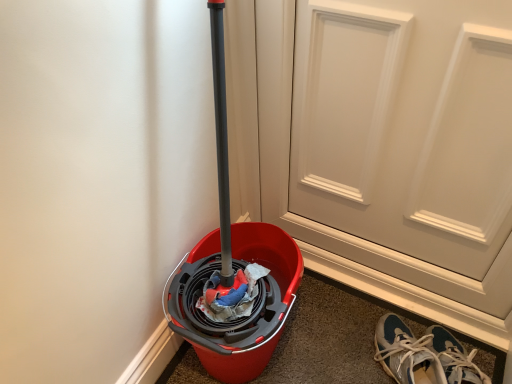
Question: Should I look upward or downward to see blue suede sneakers at lower right?

Choices:
 (A) up
 (B) down

Answer: (B)

Question: Considering the relative sizes of blue suede sneakers at lower right and white matte door at center in the image provided, is blue suede sneakers at lower right smaller than white matte door at center?

Choices:
 (A) no
 (B) yes

Answer: (B)

Question: Can you confirm if blue suede sneakers at lower right is positioned to the right of white matte door at center?

Choices:
 (A) no
 (B) yes

Answer: (B)

Question: From the image's perspective, is blue suede sneakers at lower right beneath white matte door at center?

Choices:
 (A) yes
 (B) no

Answer: (A)

Question: Does blue suede sneakers at lower right have a lesser height compared to white matte door at center?

Choices:
 (A) yes
 (B) no

Answer: (A)

Question: Considering the relative sizes of blue suede sneakers at lower right and white matte door at center in the image provided, is blue suede sneakers at lower right wider than white matte door at center?

Choices:
 (A) no
 (B) yes

Answer: (B)

Question: From a real-world perspective, does blue suede sneakers at lower right sit lower than white matte door at center?

Choices:
 (A) no
 (B) yes

Answer: (B)

Question: Is white matte door at center touching blue suede sneakers at lower right?

Choices:
 (A) yes
 (B) no

Answer: (B)

Question: Can you confirm if white matte door at center is smaller than blue suede sneakers at lower right?

Choices:
 (A) no
 (B) yes

Answer: (A)

Question: From the image's perspective, is white matte door at center beneath blue suede sneakers at lower right?

Choices:
 (A) yes
 (B) no

Answer: (B)

Question: Is white matte door at center not near blue suede sneakers at lower right?

Choices:
 (A) no
 (B) yes

Answer: (A)

Question: Considering the relative positions of white matte door at center and blue suede sneakers at lower right in the image provided, is white matte door at center behind blue suede sneakers at lower right?

Choices:
 (A) no
 (B) yes

Answer: (A)

Question: Considering the relative positions of white matte door at center and blue suede sneakers at lower right in the image provided, is white matte door at center in front of blue suede sneakers at lower right?

Choices:
 (A) yes
 (B) no

Answer: (A)

Question: Is blue suede sneakers at lower right wider or thinner than white matte door at center?

Choices:
 (A) thin
 (B) wide

Answer: (B)